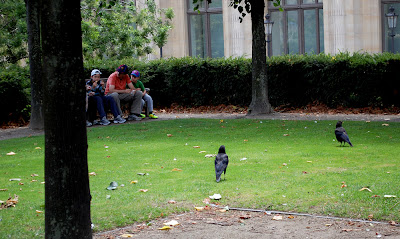
This screenshot has width=400, height=239. In order to click on windows in this screenshot , I will do `click(215, 34)`, `click(295, 33)`, `click(396, 40)`.